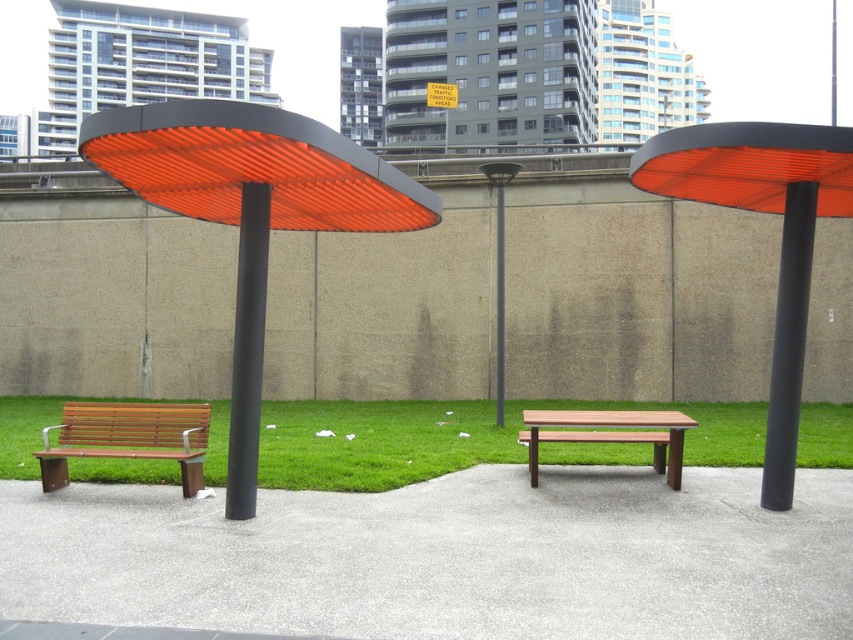
You are a maintenance worker needing to inspect the black matte pole at center and the wooden bench at center. You have a 3 meter long inspection tool. Can you reach the pole from the bench without moving the tool?

The distance between the black matte pole at center and the wooden bench at center is 3.14 meters. Since the inspection tool is only 3 meters long, it is not long enough to reach the pole from the bench without moving the tool.

You are a city planner evaluating the placement of two poles in the urban setting. The scene shows a black matte pole at center and a black metal pole at center. Which pole would cast a wider shadow given their sizes?

The black matte pole at center is larger in size than the black metal pole at center, so it would cast a wider shadow.